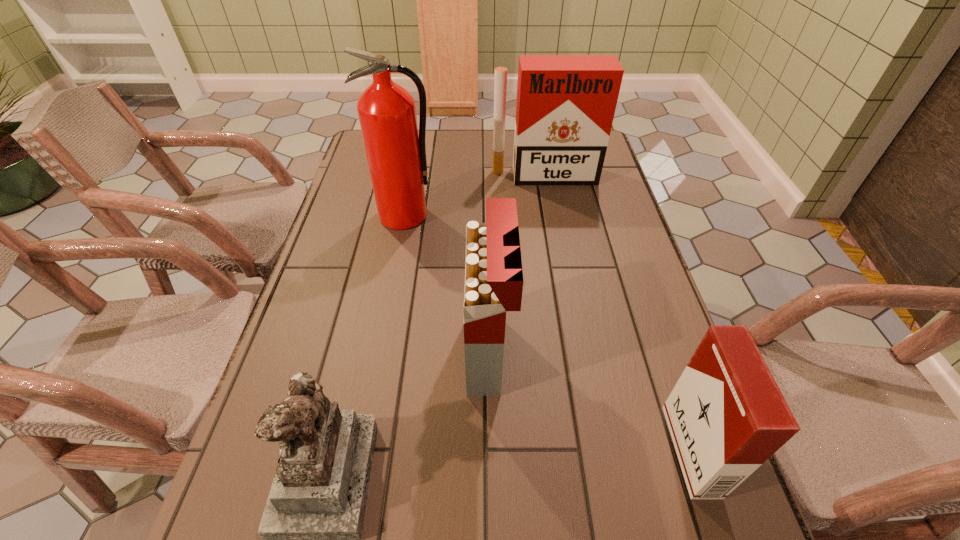
Image resolution: width=960 pixels, height=540 pixels. What are the coordinates of `free space located 0.340m on the front-facing side of the nearest cigarette_case` in the screenshot? It's located at (479, 450).

Locate an element on the screen. The width and height of the screenshot is (960, 540). free space located 0.070m on the front-facing side of the nearest cigarette_case is located at coordinates (636, 450).

This screenshot has width=960, height=540. In order to click on vacant space located on the front-facing side of the nearest cigarette_case in this screenshot , I will do [519, 450].

Locate an element on the screen. object positioned at the far edge is located at coordinates (565, 106).

This screenshot has height=540, width=960. Find the location of `object located at the left edge`. object located at the left edge is located at coordinates (396, 154).

Find the location of a particular element. The image size is (960, 540). object located in the far right corner section of the desktop is located at coordinates (565, 106).

Locate an element on the screen. vacant space at the far edge is located at coordinates (511, 160).

Where is `vacant position at the left edge of the desktop`? This screenshot has width=960, height=540. vacant position at the left edge of the desktop is located at coordinates (389, 234).

Identify the location of vacant space at the right edge of the desktop. (663, 321).

Identify the location of vacant area that lies between the second farthest object and the shortest cigarette_case. (548, 333).